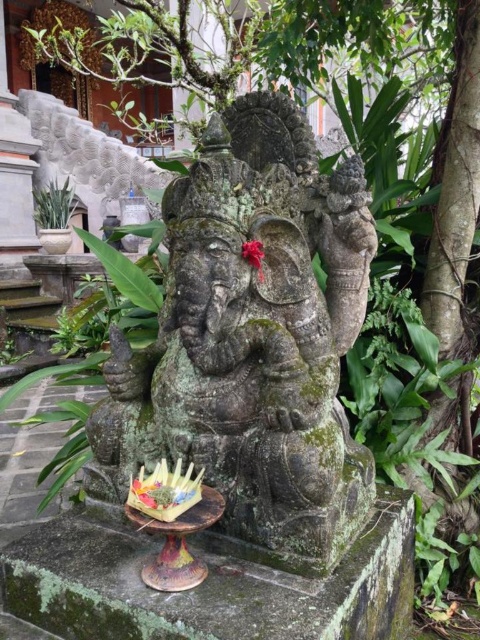
You are a gardener tasked with watering the green mossy stone statue at center and the green leafy plant at left. You have a watering can that can hold enough water for 15 feet of travel. Can you water both without refilling?

The distance between the green mossy stone statue at center and the green leafy plant at left is 17.21 feet, which is greater than the 15 feet capacity of the watering can. Therefore, you cannot water both without refilling.

You are a visitor at the statue and want to take a photo of the green mossy stone statue at center without any obstruction. Is the green leafy plant at left blocking the view of the statue?

The green mossy stone statue at center is positioned under the green leafy plant at left, so the plant is blocking the view of the statue. Move to a different angle to avoid the obstruction.